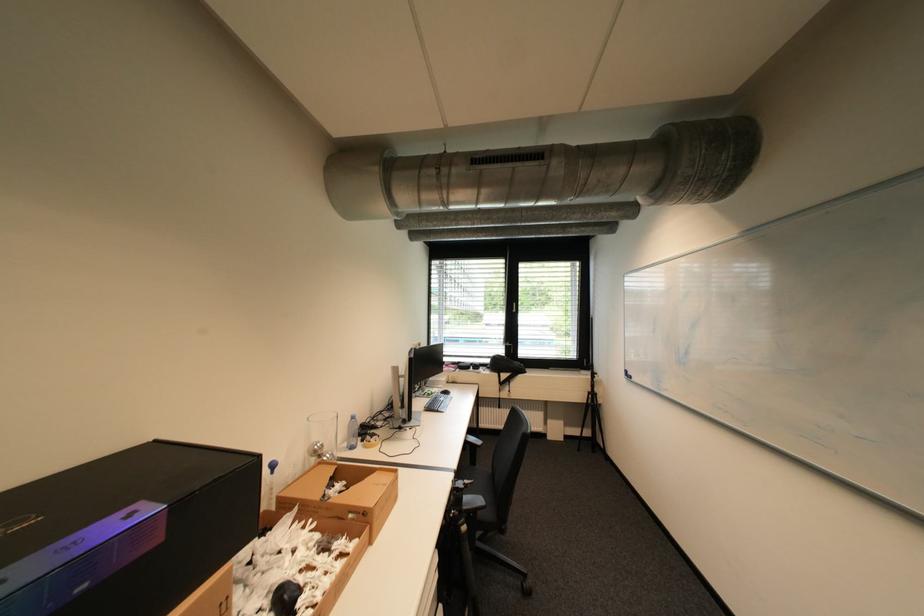
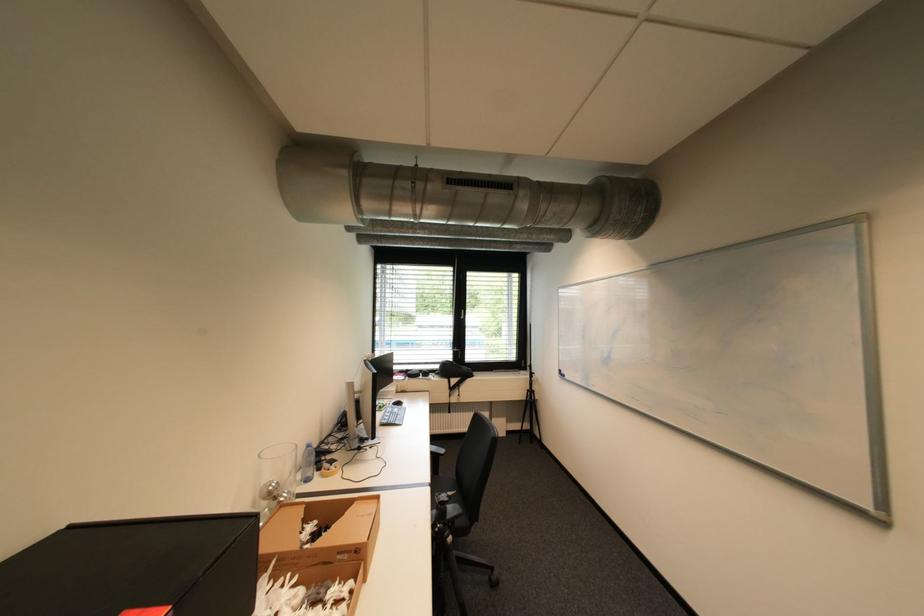
The point at (x=339, y=477) is marked in the first image. Where is the corresponding point in the second image?

(311, 520)